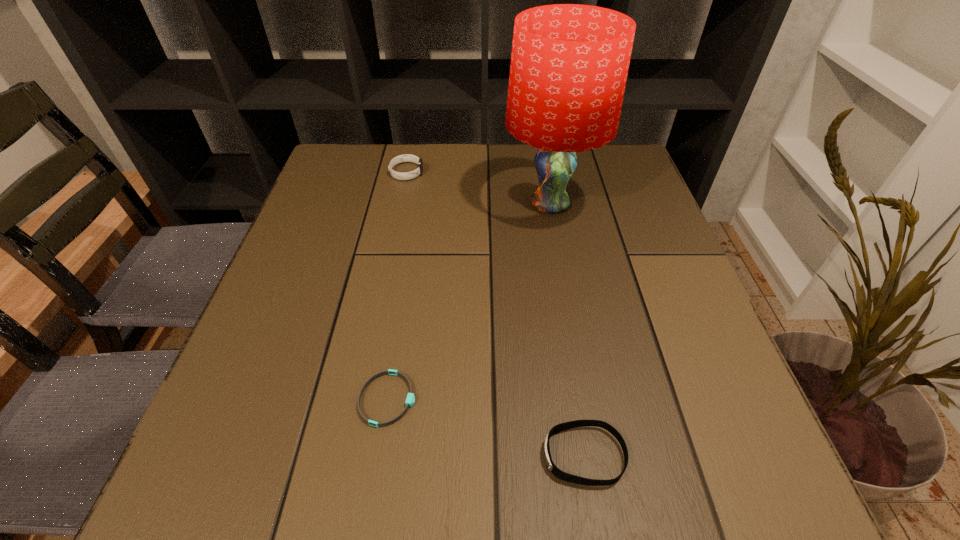
This screenshot has height=540, width=960. Identify the location of unoccupied position between the farthest wristband and the lampshade. (478, 188).

Locate an element on the screen. The image size is (960, 540). free space between the rightmost wristband and the tallest object is located at coordinates (566, 330).

Find the location of a particular element. This screenshot has height=540, width=960. object that is the closest to the second tallest wristband is located at coordinates click(x=410, y=399).

Locate which object ranks in proximity to the tallest object. Please provide its 2D coordinates. Your answer should be formatted as a tuple, i.e. [(x, y)], where the tuple contains the x and y coordinates of a point satisfying the conditions above.

[(406, 157)]

Locate which wristband is the third closest to the lampshade. Please provide its 2D coordinates. Your answer should be formatted as a tuple, i.e. [(x, y)], where the tuple contains the x and y coordinates of a point satisfying the conditions above.

[(564, 476)]

At what (x,y) coordinates should I click in order to perform the action: click on wristband that is the second closest to the farthest wristband. Please return your answer as a coordinate pair (x, y). This screenshot has height=540, width=960. Looking at the image, I should click on (564, 476).

Identify the location of free space that satisfies the following two spatial constraints: 1. on the front-facing side of the lampshade; 2. on the display of the second shortest object. This screenshot has width=960, height=540. (595, 456).

Locate an element on the screen. The height and width of the screenshot is (540, 960). free region that satisfies the following two spatial constraints: 1. on the front-facing side of the tallest object; 2. on the buckle of the shortest object is located at coordinates (586, 399).

The image size is (960, 540). In order to click on free location that satisfies the following two spatial constraints: 1. on the front-facing side of the lampshade; 2. on the buckle of the shortest wristband in this screenshot , I will do `click(586, 399)`.

Find the location of `vacant point that satisfies the following two spatial constraints: 1. on the front-facing side of the lampshade; 2. on the buckle of the shortest wristband`. vacant point that satisfies the following two spatial constraints: 1. on the front-facing side of the lampshade; 2. on the buckle of the shortest wristband is located at coordinates (586, 399).